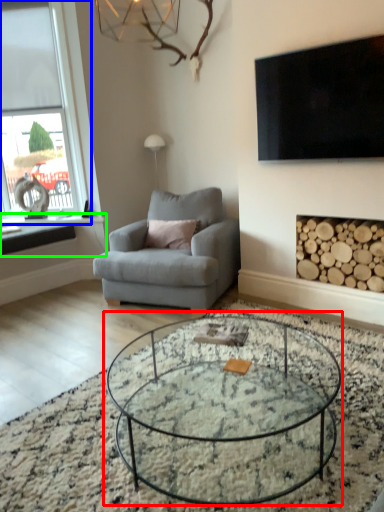
Question: Considering the real-world distances, which object is farthest from coffee table (highlighted by a red box)? window (highlighted by a blue box) or window sill (highlighted by a green box)?

Choices:
 (A) window
 (B) window sill

Answer: (A)